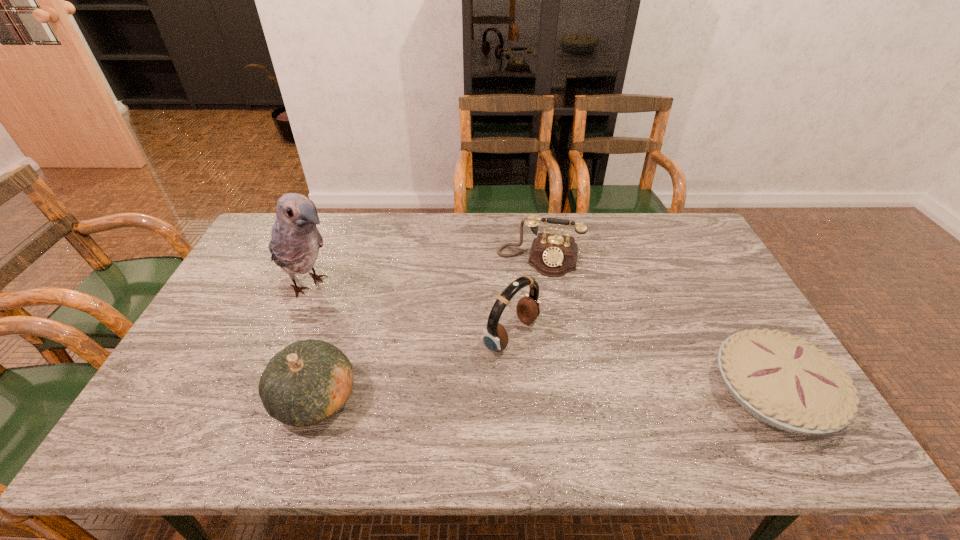
Image resolution: width=960 pixels, height=540 pixels. I want to click on object present at the left edge, so click(x=295, y=241).

The image size is (960, 540). What are the coordinates of `object situated at the right edge` in the screenshot? It's located at (785, 382).

Image resolution: width=960 pixels, height=540 pixels. What are the coordinates of `object that is at the near right corner` in the screenshot? It's located at (785, 382).

In the image, there is a desktop. Identify the location of blank space at the far edge. This screenshot has width=960, height=540. (455, 228).

The image size is (960, 540). Find the location of `vacant space at the near edge of the desktop`. vacant space at the near edge of the desktop is located at coordinates (x=650, y=395).

Locate an element on the screen. The image size is (960, 540). free space at the left edge of the desktop is located at coordinates (255, 266).

Locate an element on the screen. vacant area at the right edge of the desktop is located at coordinates (733, 303).

Where is `vacant space at the near left corner of the desktop`? vacant space at the near left corner of the desktop is located at coordinates (192, 387).

This screenshot has height=540, width=960. What are the coordinates of `empty space between the parrot and the pie` in the screenshot? It's located at (541, 338).

This screenshot has width=960, height=540. Identify the location of vacant point located between the pie and the gourd. (544, 395).